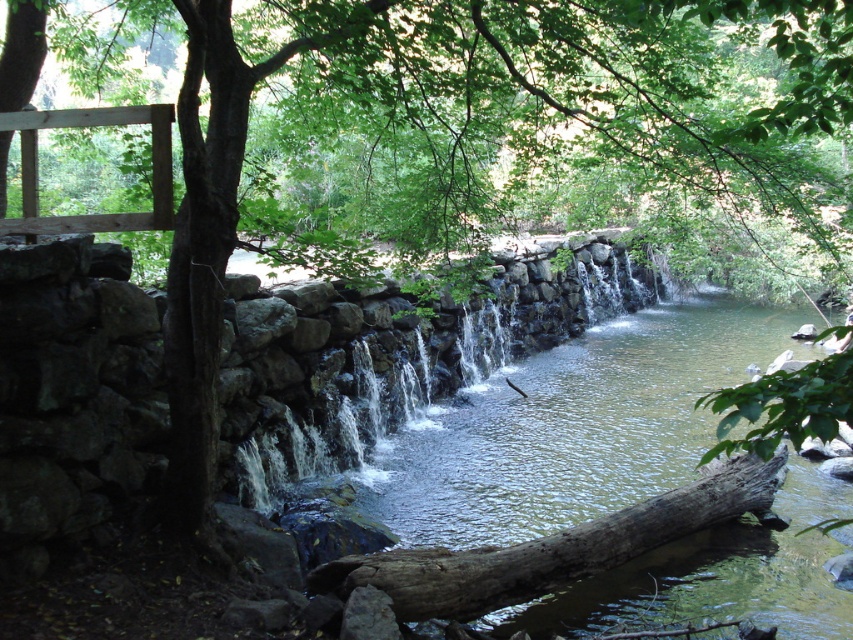
You are standing in the natural scene and want to take a photo of the clear stone waterfall at center. If your camera has a maximum focus range of 8 meters, will you need to move closer to the waterfall to capture it clearly?

The clear stone waterfall at center is 8.44 meters away from the viewer. Since the camera can only focus up to 8 meters, you need to move closer to the waterfall to ensure it is in focus.

You are standing at the edge of the calm body of water in the scene. There is a clear stone waterfall at center marked by point (393, 356). If you want to walk towards the waterfall, which direction should you head?

The clear stone waterfall at center is located at point (393, 356), so you should head towards the center of the image to reach it.

You are standing at the edge of the waterfall and want to place a small decorative rock at each of the two points, point (503,305) and point (659,497). Which point is closer to you so that the rock will be more visible to visitors approaching from the front?

Point (503,305) is closer to the viewer than point (659,497), so placing the rock there will make it more visible to visitors approaching from the front.